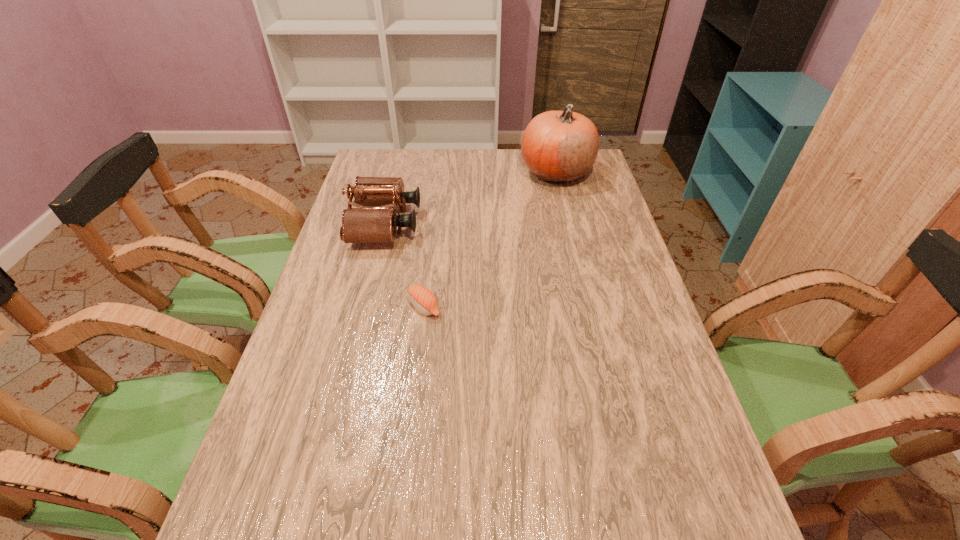
Identify the location of empty location between the shortest object and the rightmost object. (491, 239).

Where is `blank region between the shortest object and the pumpkin`? This screenshot has width=960, height=540. blank region between the shortest object and the pumpkin is located at coordinates (491, 239).

Point out which object is positioned as the nearest to the tallest object. Please provide its 2D coordinates. Your answer should be formatted as a tuple, i.e. [(x, y)], where the tuple contains the x and y coordinates of a point satisfying the conditions above.

[(364, 224)]

Identify the location of object that can be found as the closest to the farthest object. (364, 224).

Find the location of `free space that satisfies the following two spatial constraints: 1. through the eyepieces of the second shortest object; 2. on the left side of the nearest object`. free space that satisfies the following two spatial constraints: 1. through the eyepieces of the second shortest object; 2. on the left side of the nearest object is located at coordinates (363, 307).

Find the location of a particular element. The width and height of the screenshot is (960, 540). vacant region that satisfies the following two spatial constraints: 1. on the back side of the second object from left to right; 2. on the right side of the farthest object is located at coordinates (441, 172).

Where is `free space that satisfies the following two spatial constraints: 1. through the eyepieces of the shortest object; 2. on the right side of the leftmost object`? Image resolution: width=960 pixels, height=540 pixels. free space that satisfies the following two spatial constraints: 1. through the eyepieces of the shortest object; 2. on the right side of the leftmost object is located at coordinates (363, 307).